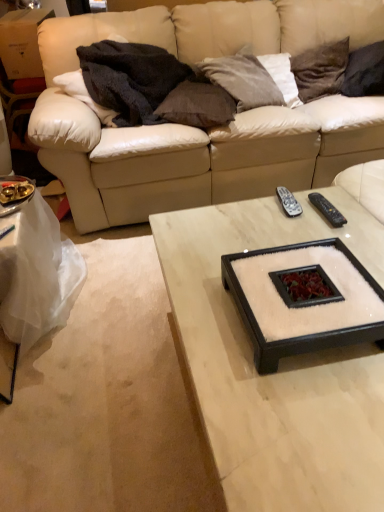
Identify the location of vacant area that lies between black plastic remote control at right, marked as the second remote control in a left-to-right arrangement, and black plastic remote control at center, the 2th remote control when ordered from right to left. (305, 223).